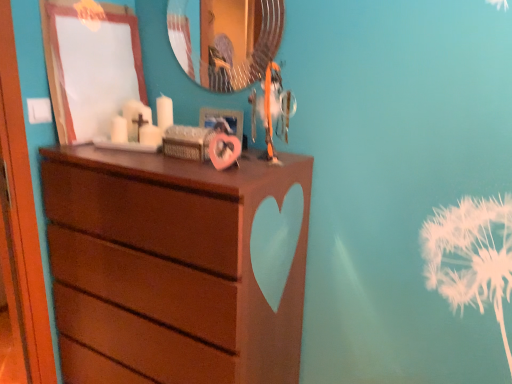
Question: In terms of size, does matte white picture frame at upper left, acting as the 2th picture frame starting from the right, appear bigger or smaller than teal glossy mirror at upper center?

Choices:
 (A) big
 (B) small

Answer: (A)

Question: From the image's perspective, is matte white picture frame at upper left, acting as the 2th picture frame starting from the right, located above or below teal glossy mirror at upper center?

Choices:
 (A) below
 (B) above

Answer: (A)

Question: Estimate the real-world distances between objects in this image. Which object is closer to the metallic silver picture frame at upper center, which is the first picture frame from right to left?

Choices:
 (A) teal glossy mirror at upper center
 (B) matte brown dresser at center
 (C) matte white picture frame at upper left, positioned as the first picture frame in left-to-right order

Answer: (A)

Question: Considering the real-world distances, which object is farthest from the matte brown dresser at center?

Choices:
 (A) matte white picture frame at upper left, acting as the 2th picture frame starting from the right
 (B) teal glossy mirror at upper center
 (C) metallic silver picture frame at upper center, which is the first picture frame from right to left

Answer: (B)